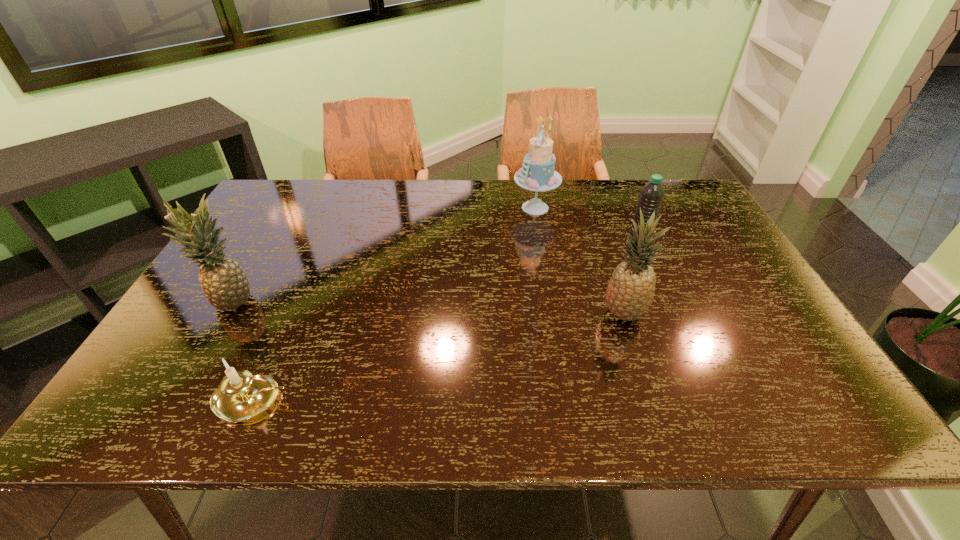
The width and height of the screenshot is (960, 540). What are the coordinates of `vacant space that's between the nearest object and the rightmost object` in the screenshot? It's located at (445, 320).

This screenshot has height=540, width=960. Identify the location of empty space between the shortest object and the water bottle. (445, 320).

This screenshot has width=960, height=540. I want to click on vacant space that's between the rightmost object and the second object from left to right, so click(445, 320).

Image resolution: width=960 pixels, height=540 pixels. What are the coordinates of `unoccupied position between the second object from right to left and the leftmost object` in the screenshot? It's located at (428, 307).

Identify the location of object that ranks as the fourth closest to the cake. (241, 396).

Find the location of `object that ranks as the third closest to the fourth tallest object`. object that ranks as the third closest to the fourth tallest object is located at coordinates (241, 396).

I want to click on vacant space that satisfies the following two spatial constraints: 1. with a ladder on the side of the fourth object from left to right; 2. on the left side of the cake, so click(553, 314).

Locate an element on the screen. This screenshot has height=540, width=960. vacant space that satisfies the following two spatial constraints: 1. on the back side of the second farthest object; 2. on the left side of the second object from right to left is located at coordinates (599, 240).

Locate an element on the screen. This screenshot has height=540, width=960. free location that satisfies the following two spatial constraints: 1. with a ladder on the side of the fourth object from left to right; 2. on the left side of the cake is located at coordinates (553, 314).

Locate an element on the screen. The image size is (960, 540). vacant space that satisfies the following two spatial constraints: 1. with a ladder on the side of the farthest object; 2. on the left side of the rightmost object is located at coordinates (540, 240).